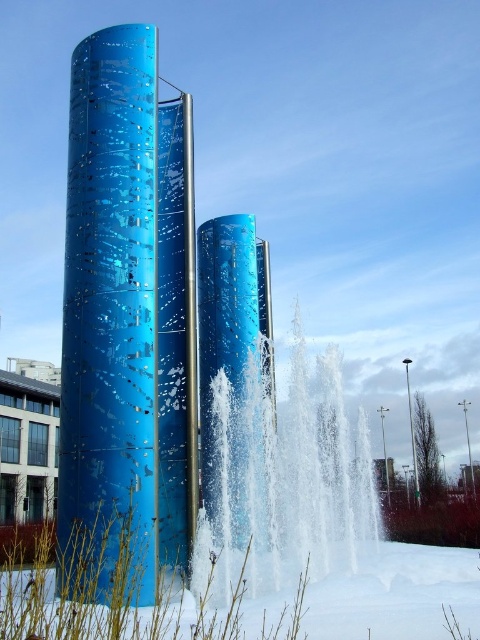
Who is more forward, (178,141) or (332,349)?

Point (332,349) is in front.

Does point (191, 192) come behind point (233, 422)?

No, it is in front of (233, 422).

At what (x,y) coordinates should I click in order to perform the action: click on blue metallic tower at left. Please return your answer as a coordinate pair (x, y). The image size is (480, 640). Looking at the image, I should click on (120, 321).

Can you confirm if clear water at center is positioned below glossy metallic tower at center?

Yes.

Does clear water at center appear on the left side of glossy metallic tower at center?

No, clear water at center is not to the left of glossy metallic tower at center.

The image size is (480, 640). What are the coordinates of `clear water at center` in the screenshot? It's located at (307, 476).

Who is shorter, blue metallic tower at left or glossy metallic tower at center?

Standing shorter between the two is glossy metallic tower at center.

Does blue metallic tower at left appear on the right side of glossy metallic tower at center?

Incorrect, blue metallic tower at left is not on the right side of glossy metallic tower at center.

Between point (134, 227) and point (268, 380), which one is positioned behind?

The point (268, 380) is behind.

Find the location of a particular element. This screenshot has height=640, width=480. blue metallic tower at left is located at coordinates (120, 321).